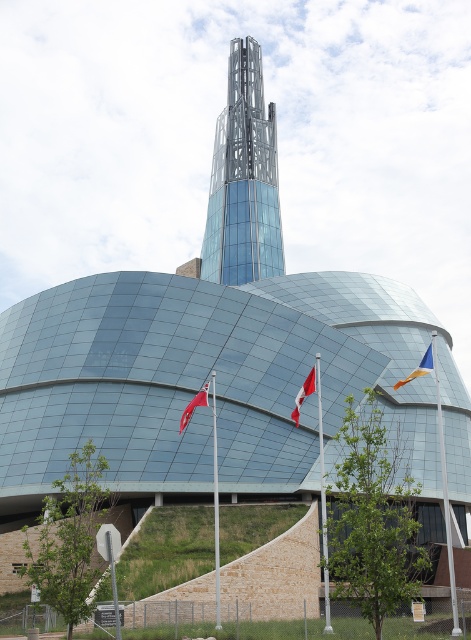
Does orange fabric flag at right come behind red fabric flag at center?

No.

This screenshot has width=471, height=640. In order to click on orange fabric flag at right in this screenshot , I will do `click(420, 368)`.

Is point (222, 118) behind point (187, 413)?

Yes, point (222, 118) is farther from viewer.

Which is in front, point (260, 227) or point (189, 412)?

Point (189, 412) is more forward.

Is point (227, 179) farther from camera compared to point (203, 394)?

Yes, point (227, 179) is behind point (203, 394).

Identify the location of transparent glass tower at center. The height and width of the screenshot is (640, 471). (243, 179).

Is orange fabric flag at right shorter than red fabric flag at lower center?

No, orange fabric flag at right is not shorter than red fabric flag at lower center.

Looking at this image, which is more to the left, orange fabric flag at right or red fabric flag at lower center?

red fabric flag at lower center

This screenshot has height=640, width=471. Describe the element at coordinates (420, 368) in the screenshot. I see `orange fabric flag at right` at that location.

Where is `orange fabric flag at right`? Image resolution: width=471 pixels, height=640 pixels. orange fabric flag at right is located at coordinates (420, 368).